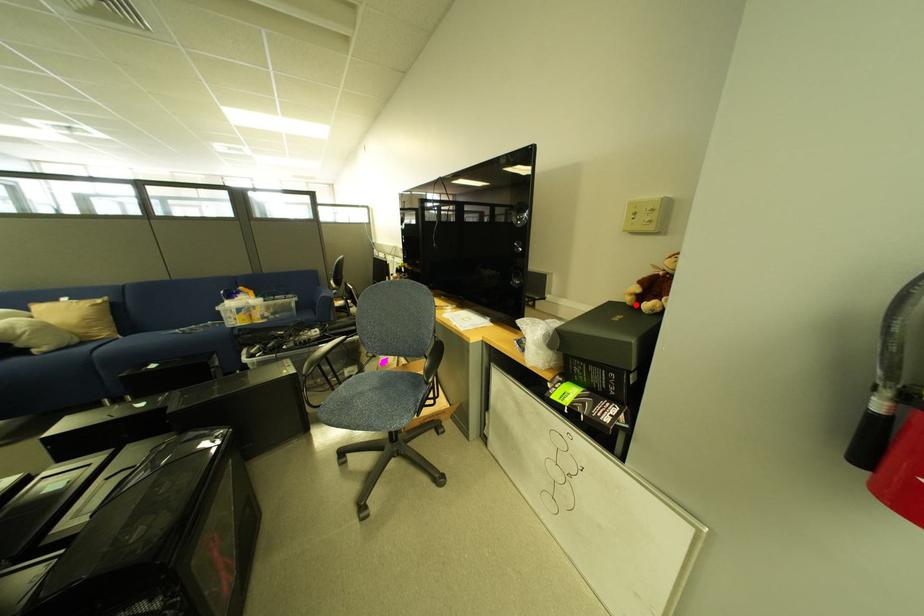
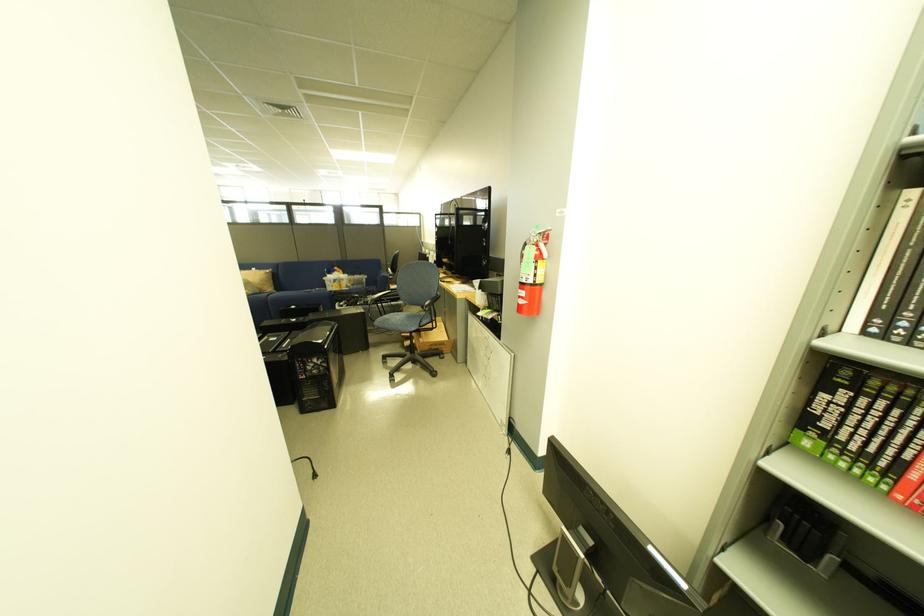
Question: I am providing you with two images of the same scene from different viewpoints. A red point is marked on the first image. At the location where the point appears in image 1, is it still visible in image 2?

Choices:
 (A) Yes
 (B) No

Answer: (B)